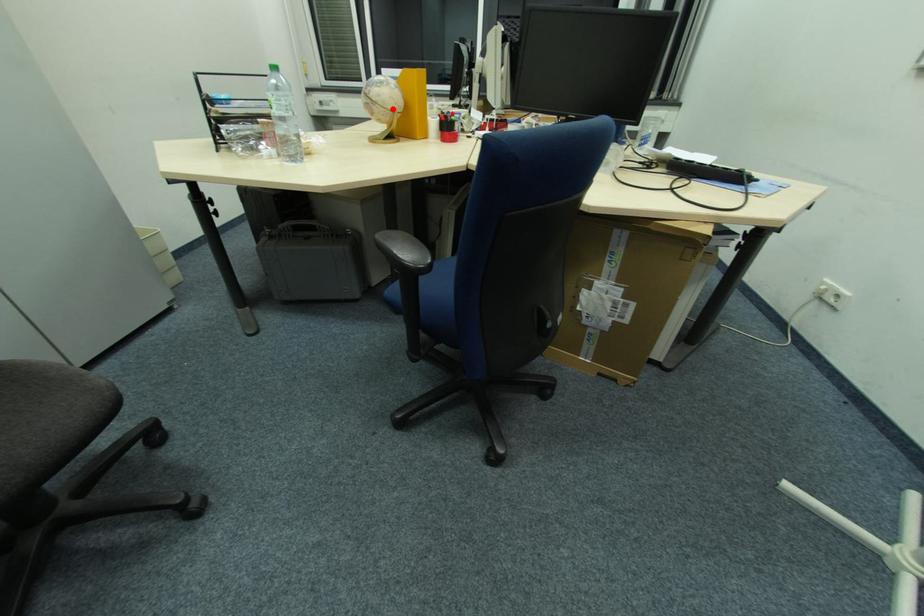
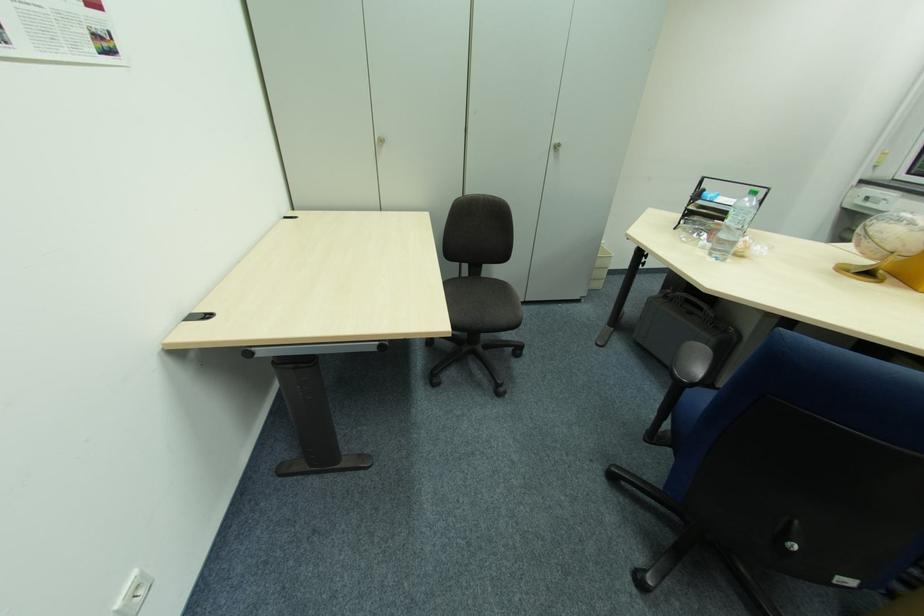
Where in the second image is the point corresponding to the highlighted location from the first image?

(893, 249)